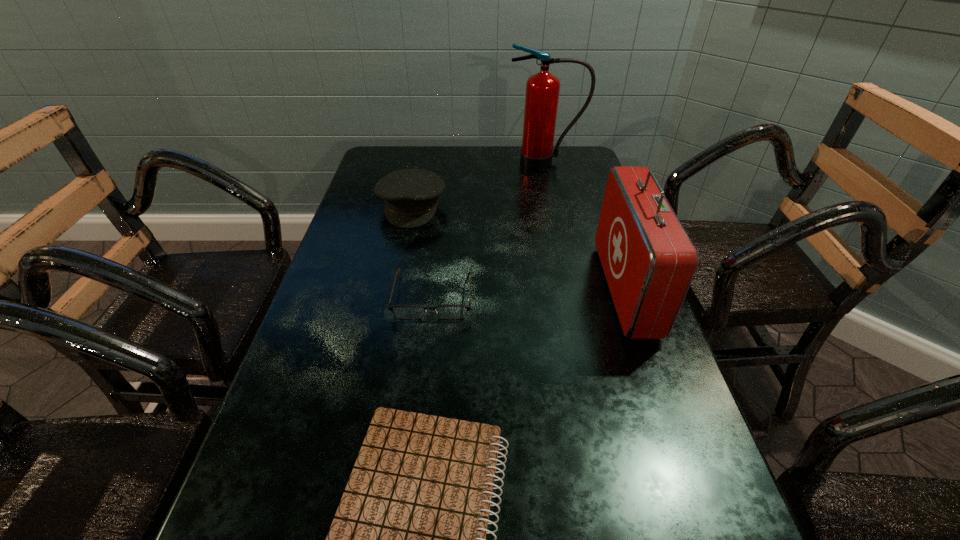
Locate an element on the screen. the tallest object is located at coordinates (542, 89).

Find the location of `the farthest object`. the farthest object is located at coordinates (542, 89).

What are the coordinates of `the second tallest object` in the screenshot? It's located at (649, 261).

Locate an element on the screen. This screenshot has width=960, height=540. the fourth nearest object is located at coordinates (411, 196).

Identify the location of the third shortest object. Image resolution: width=960 pixels, height=540 pixels. (411, 196).

Where is `spectacles`? spectacles is located at coordinates (400, 311).

You are a GUI agent. You are given a task and a screenshot of the screen. Output one action in this format:
    pyautogui.click(x=<x>, y=<y>)
    Task: Click on the blank area located 0.240m on the left of the tallest object
    The height and width of the screenshot is (540, 960).
    Given the screenshot: What is the action you would take?
    pyautogui.click(x=436, y=161)

Locate an element on the screen. Image resolution: width=960 pixels, height=540 pixels. vacant space located on the side of the first-aid kit with the first aid cross symbol is located at coordinates (555, 289).

The width and height of the screenshot is (960, 540). Find the location of `free region located 0.400m on the side of the first-aid kit with the first aid cross symbol`. free region located 0.400m on the side of the first-aid kit with the first aid cross symbol is located at coordinates (433, 289).

I want to click on free space located 0.050m on the side of the first-aid kit with the first aid cross symbol, so click(x=585, y=289).